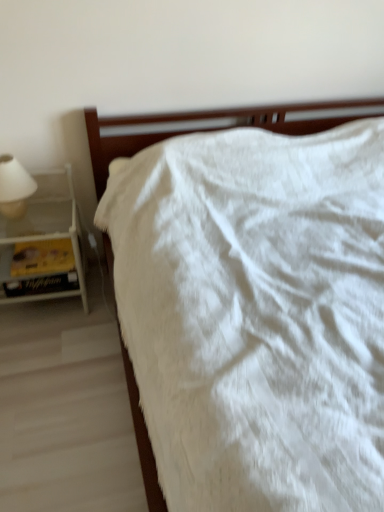
What do you see at coordinates (206, 119) in the screenshot? Image resolution: width=384 pixels, height=512 pixels. I see `white fluffy blanket at center` at bounding box center [206, 119].

The height and width of the screenshot is (512, 384). Describe the element at coordinates (42, 285) in the screenshot. I see `yellow paper at left` at that location.

In order to face white matte lampshade at left, should I rotate leftwards or rightwards?

Rotate your view left by about 22.790°.

Image resolution: width=384 pixels, height=512 pixels. I want to click on white fluffy blanket at center, so [x=206, y=119].

Considering their positions, is white matte lampshade at left located in front of or behind yellow paper at left?

Clearly, white matte lampshade at left is in front of yellow paper at left.

From a real-world perspective, who is located lower, white matte lampshade at left or yellow paper at left?

yellow paper at left.

Could yellow paper at left be considered to be inside white matte lampshade at left?

No, yellow paper at left is not a part of white matte lampshade at left.

Considering the sizes of objects yellow paper at left and white matte lampshade at left in the image provided, who is taller, yellow paper at left or white matte lampshade at left?

white matte lampshade at left.

Would you say yellow paper at left is to the left or to the right of white matte lampshade at left in the picture?

In the image, yellow paper at left appears on the right side of white matte lampshade at left.

Can you confirm if yellow paper at left is bigger than white matte lampshade at left?

Actually, yellow paper at left might be smaller than white matte lampshade at left.

Is white glossy nightstand at left wider or thinner than white matte lampshade at left?

Considering their sizes, white glossy nightstand at left looks broader than white matte lampshade at left.

Measure the distance between white glossy nightstand at left and white matte lampshade at left.

white glossy nightstand at left and white matte lampshade at left are 7.99 inches apart from each other.

Is white glossy nightstand at left facing away from white matte lampshade at left?

No.

From a real-world perspective, is white glossy nightstand at left on top of white matte lampshade at left?

Incorrect, from a real-world perspective, white glossy nightstand at left is lower than white matte lampshade at left.

This screenshot has height=512, width=384. Identify the location of nightstand that appears in front of the yellow paper at left. (43, 244).

Who is bigger, yellow paper at left or white glossy nightstand at left?

white glossy nightstand at left.

From the image's perspective, is yellow paper at left positioned above or below white glossy nightstand at left?

yellow paper at left is below white glossy nightstand at left.

Considering the sizes of objects white matte lampshade at left and white fluffy blanket at center in the image provided, who is smaller, white matte lampshade at left or white fluffy blanket at center?

white matte lampshade at left.

Is white matte lampshade at left facing towards white fluffy blanket at center?

No, white matte lampshade at left is not facing towards white fluffy blanket at center.

Consider the image. Is white matte lampshade at left not near white fluffy blanket at center?

No, white matte lampshade at left is in close proximity to white fluffy blanket at center.

From the image's perspective, which one is positioned higher, white matte lampshade at left or white fluffy blanket at center?

white matte lampshade at left appears higher in the image.

Where is `bed located on the right of yellow paper at left`? bed located on the right of yellow paper at left is located at coordinates (206, 119).

Is yellow paper at left not near white fluffy blanket at center?

No, yellow paper at left is not far away from white fluffy blanket at center.

From a real-world perspective, which object stands above the other?

white fluffy blanket at center is physically above.

From the image's perspective, is yellow paper at left located above or below white fluffy blanket at center?

yellow paper at left is situated lower than white fluffy blanket at center in the image.

Between white glossy nightstand at left and yellow paper at left, which one has smaller size?

yellow paper at left.

Can you confirm if white glossy nightstand at left is shorter than yellow paper at left?

In fact, white glossy nightstand at left may be taller than yellow paper at left.

This screenshot has height=512, width=384. I want to click on nightstand lying on the left of yellow paper at left, so click(x=43, y=244).

Where is `bedside lamp above the yellow paper at left (from a real-world perspective)`? bedside lamp above the yellow paper at left (from a real-world perspective) is located at coordinates (14, 187).

What are the coordinates of `bedside lamp above the yellow paper at left (from the image's perspective)` in the screenshot? It's located at (14, 187).

Considering their positions, is white fluffy blanket at center positioned further to yellow paper at left than white matte lampshade at left?

white fluffy blanket at center.

Looking at the image, which one is located further to yellow paper at left, white glossy nightstand at left or white matte lampshade at left?

white matte lampshade at left.

Which object lies further to the anchor point white fluffy blanket at center, yellow paper at left or white matte lampshade at left?

yellow paper at left.

When comparing their distances from white matte lampshade at left, does white glossy nightstand at left or white fluffy blanket at center seem closer?

The object closer to white matte lampshade at left is white glossy nightstand at left.

Which object lies further to the anchor point white matte lampshade at left, yellow paper at left or white glossy nightstand at left?

Among the two, yellow paper at left is located further to white matte lampshade at left.

From the image, which object appears to be nearer to white fluffy blanket at center, white matte lampshade at left or yellow paper at left?

Based on the image, white matte lampshade at left appears to be nearer to white fluffy blanket at center.

Based on their spatial positions, is white glossy nightstand at left or white matte lampshade at left closer to white fluffy blanket at center?

Among the two, white glossy nightstand at left is located nearer to white fluffy blanket at center.

Based on their spatial positions, is white matte lampshade at left or yellow paper at left closer to white glossy nightstand at left?

yellow paper at left is positioned closer to the anchor white glossy nightstand at left.

Locate an element on the screen. The height and width of the screenshot is (512, 384). nightstand situated between white matte lampshade at left and white fluffy blanket at center from left to right is located at coordinates (43, 244).

Image resolution: width=384 pixels, height=512 pixels. What are the coordinates of `nightstand that lies between white matte lampshade at left and yellow paper at left from top to bottom` in the screenshot? It's located at (43, 244).

Locate an element on the screen. This screenshot has height=512, width=384. paperback book between white matte lampshade at left and white fluffy blanket at center in the horizontal direction is located at coordinates (42, 285).

The image size is (384, 512). I want to click on paperback book between white glossy nightstand at left and white fluffy blanket at center in the horizontal direction, so click(x=42, y=285).